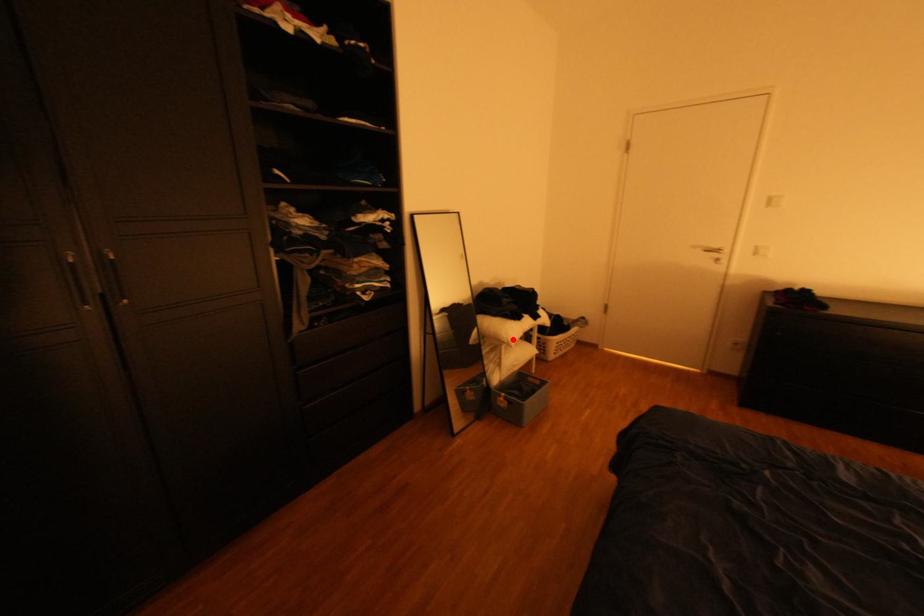
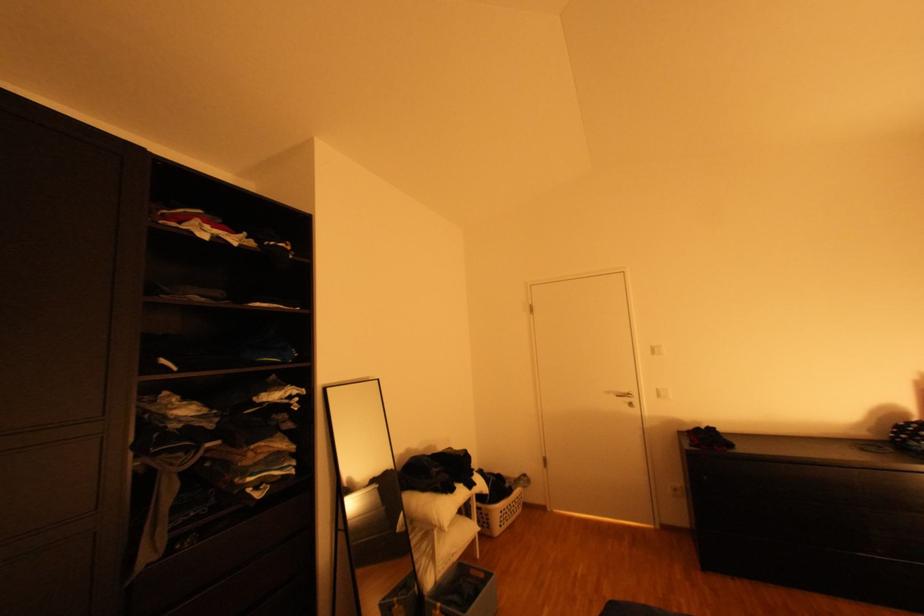
Find the pixel in the second image that matches the highlighted location in the first image.

(444, 523)